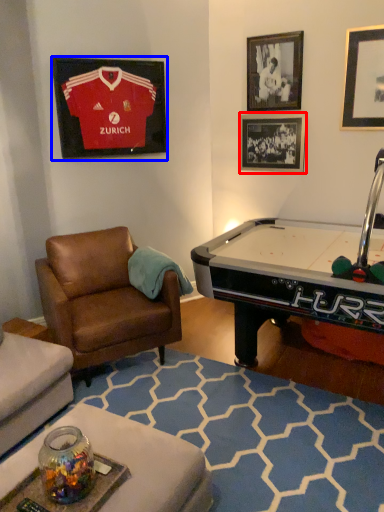
Question: Which of the following is the closest to the observer, picture frame (highlighted by a red box) or picture frame (highlighted by a blue box)?

Choices:
 (A) picture frame
 (B) picture frame

Answer: (B)